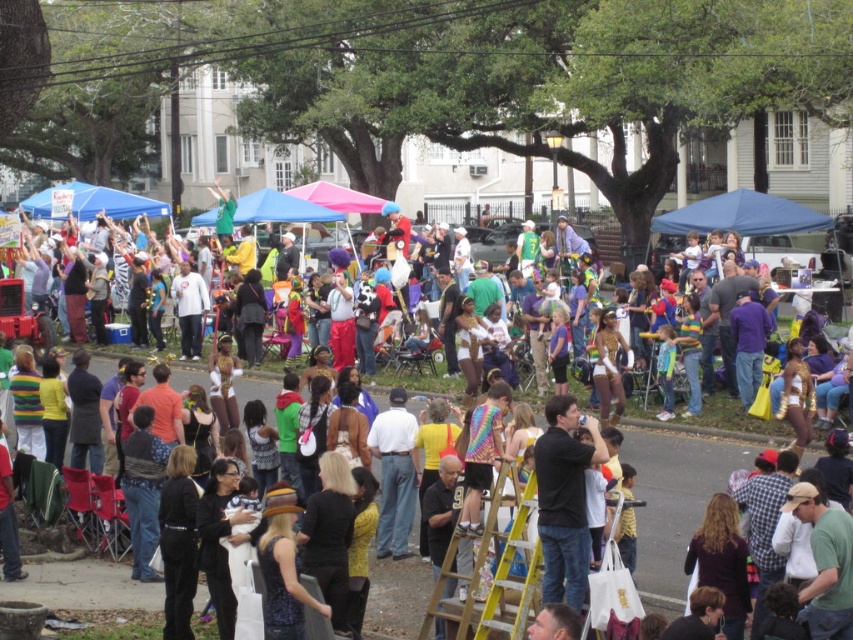
Question: Observing the image, what is the correct spatial positioning of ruffled yellow dress at center in reference to black t-shirt at center?

Choices:
 (A) below
 (B) above

Answer: (B)

Question: Does ruffled yellow dress at center have a larger size compared to black t-shirt at center?

Choices:
 (A) yes
 (B) no

Answer: (A)

Question: Considering the real-world distances, which object is farthest from the ruffled yellow dress at center?

Choices:
 (A) yellow/yellowish wood ladder at center
 (B) black t-shirt at center

Answer: (B)

Question: Is ruffled yellow dress at center above black t-shirt at center?

Choices:
 (A) yes
 (B) no

Answer: (A)

Question: Which object is the closest to the ruffled yellow dress at center?

Choices:
 (A) black t-shirt at center
 (B) yellow/yellowish wood ladder at center

Answer: (B)

Question: Among these objects, which one is farthest from the camera?

Choices:
 (A) ruffled yellow dress at center
 (B) black t-shirt at center
 (C) yellow/yellowish wood ladder at center

Answer: (A)